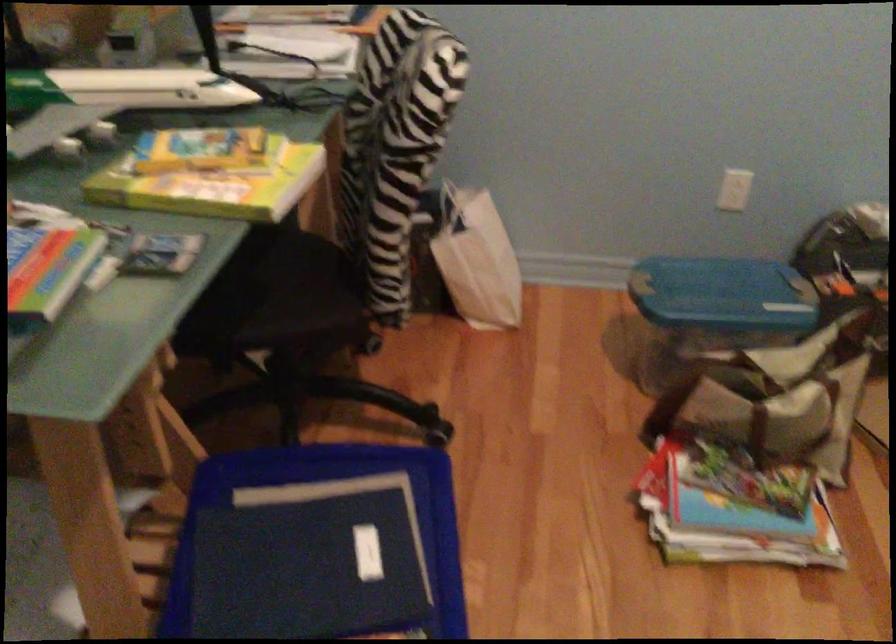
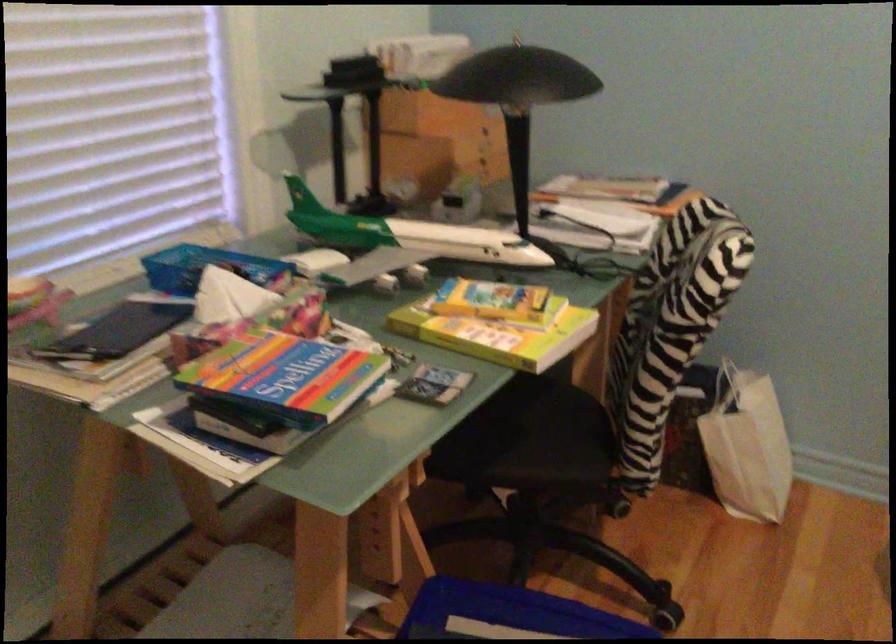
Find the pixel in the second image that matches point 80,90 in the first image.

(408, 232)